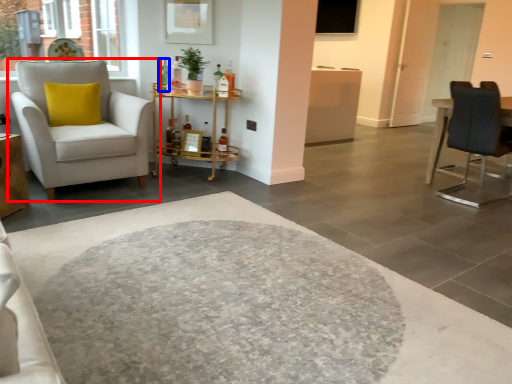
Question: Which object is closer to the camera taking this photo, chair (highlighted by a red box) or bottle (highlighted by a blue box)?

Choices:
 (A) chair
 (B) bottle

Answer: (A)